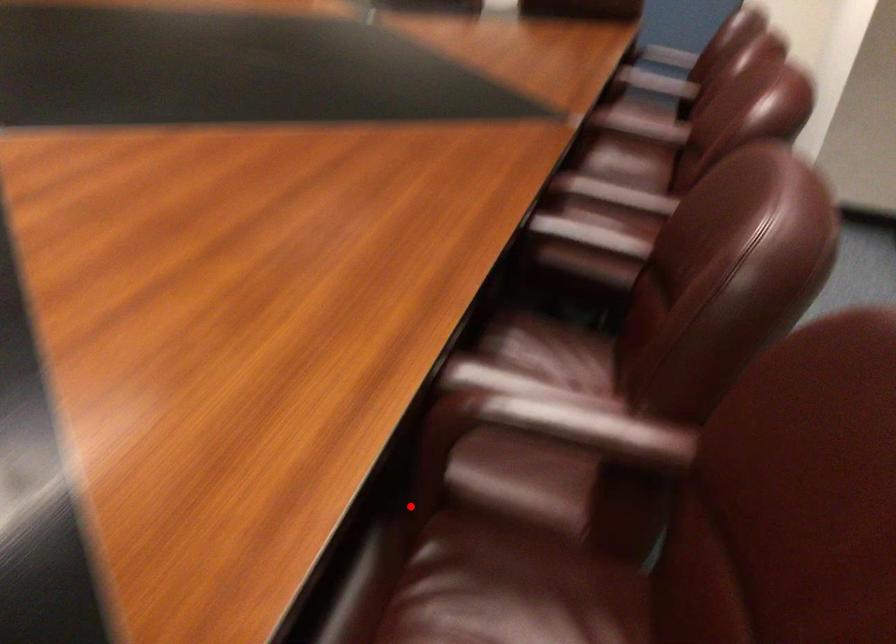
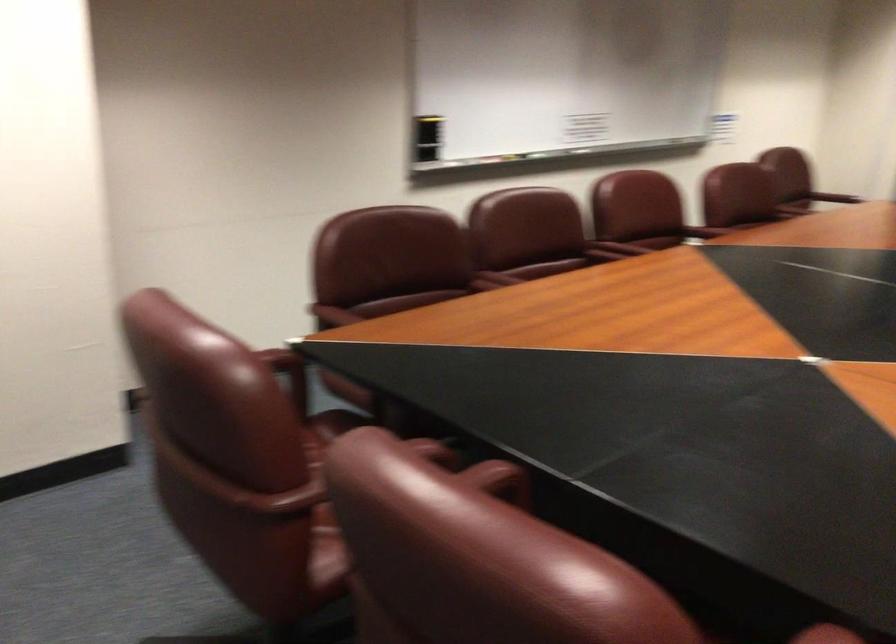
Question: I am providing you with two images of the same scene from different viewpoints. A red point is shown in image1. For the corresponding object point in image2, is it positioned nearer or farther from the camera?

Choices:
 (A) Nearer
 (B) Farther

Answer: (B)